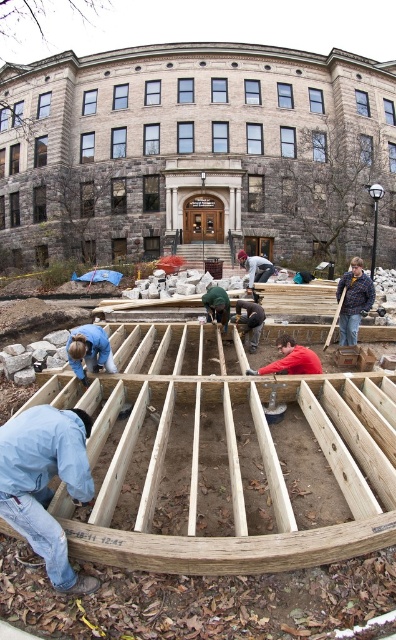
You are a safety inspector checking the construction site. You notice the wooden frame at center and the light blue denim jacket at lower left. According to safety protocols, workers must not have any objects above them during work. Is there a safety violation here?

Yes, there is a safety violation because the wooden frame at center is positioned over the light blue denim jacket at lower left, which means the worker wearing the jacket has an object above them, violating safety protocols.

You are a safety inspector examining the construction site. You notice the wooden frame at center and the light blue denim jacket at lower left. Based on their heights, which object is taller?

The wooden frame at center is taller than the light blue denim jacket at lower left according to the description.

You are a construction supervisor standing in front of the wooden frame at center and the light blue denim jacket at lower left. Which object is closer to you?

The wooden frame at center is closer to you than the light blue denim jacket at lower left because the description states it is further to the viewer.